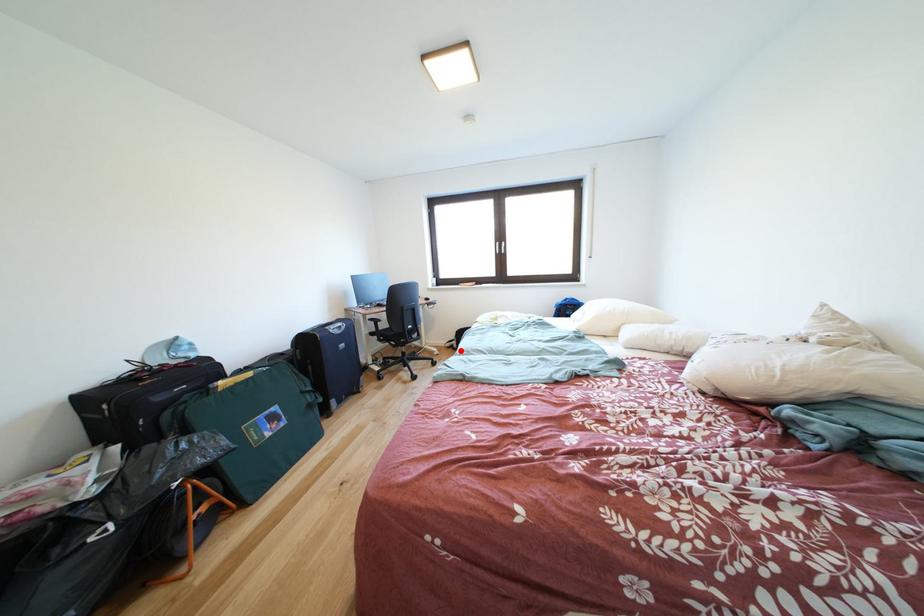
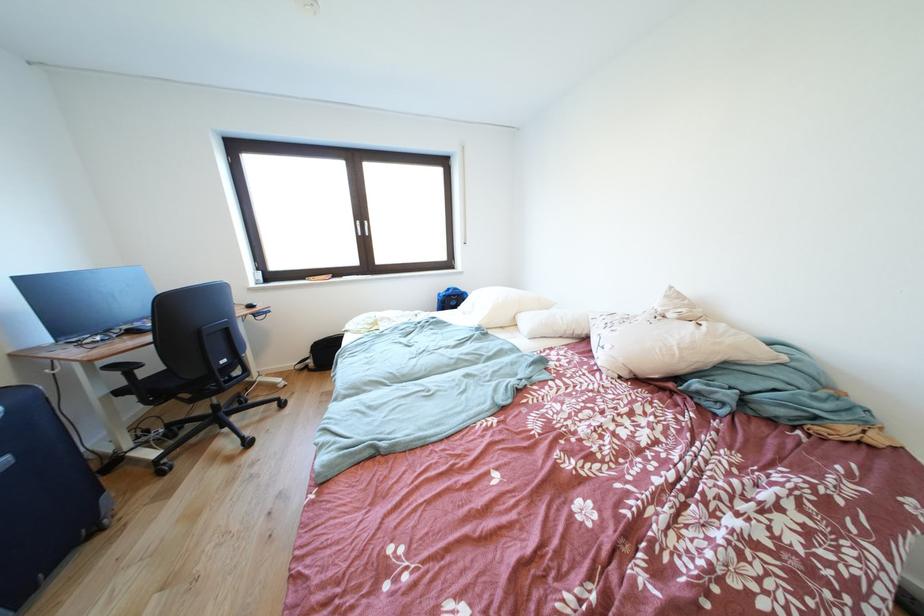
Question: I am providing you with two images of the same scene from different viewpoints. A red point is shown in image1. For the corresponding object point in image2, is it positioned nearer or farther from the camera?

Choices:
 (A) Nearer
 (B) Farther

Answer: (B)